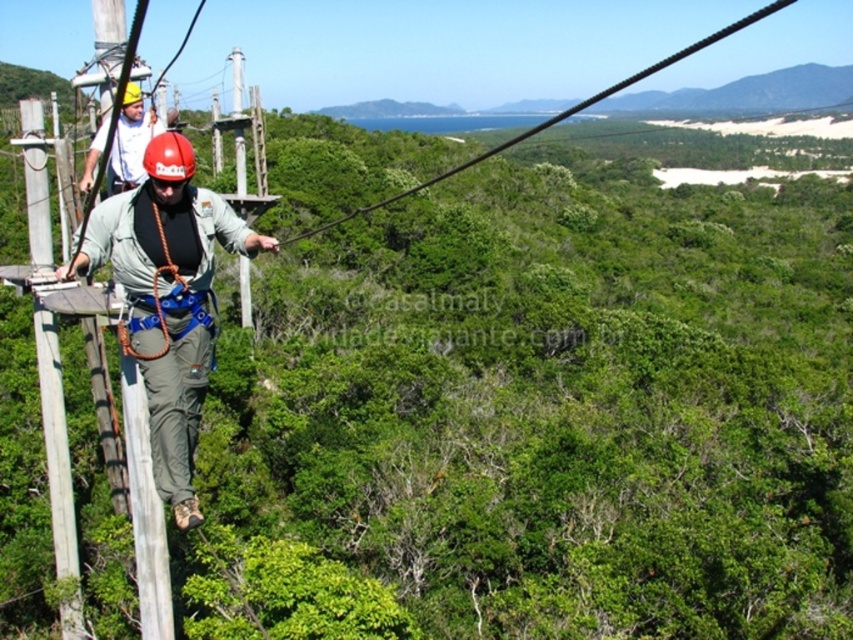
You are a safety inspector checking the obstacle course. You notice a point marked at coordinates (167, 298). What object is located at that point?

The point at coordinates (167, 298) marks the location of the matte khaki pants at center.

You are an equipment inspector checking the gear of the participants in the obstacle course. You notice the matte khaki pants at center and the matte yellow helmet at upper left. Which item has a smaller width?

The matte khaki pants at center has a smaller width than the matte yellow helmet at upper left.